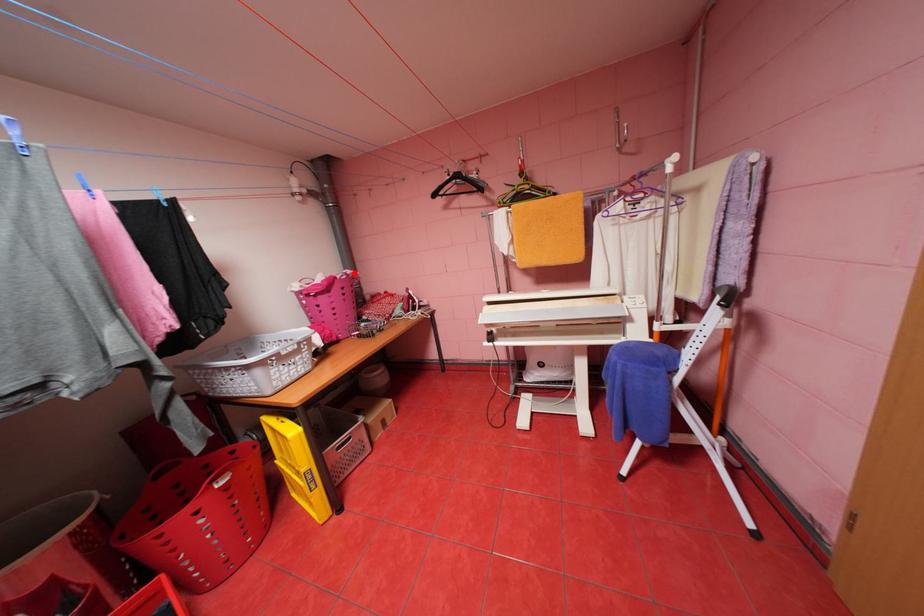
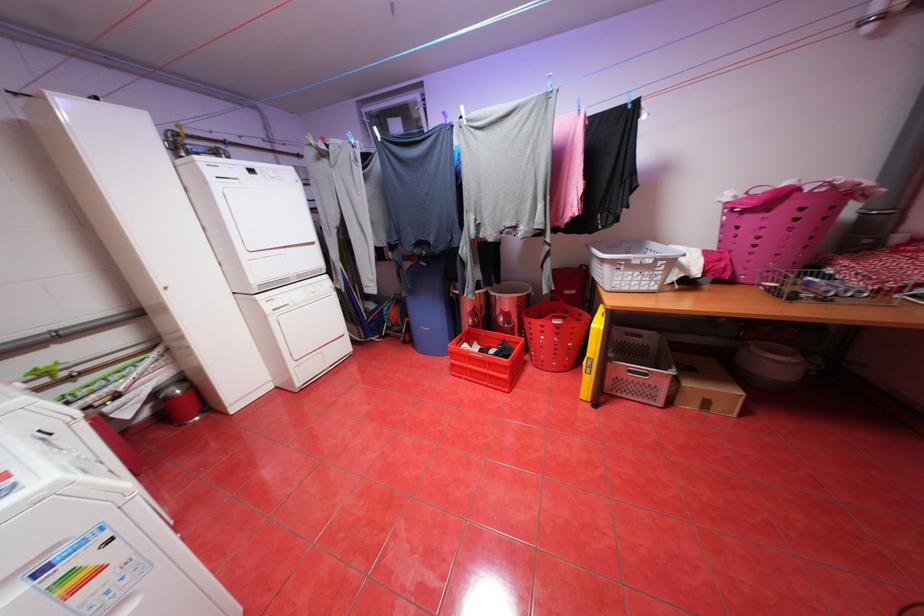
The point at the highlighted location is marked in the first image. Where is the corresponding point in the second image?

(839, 183)